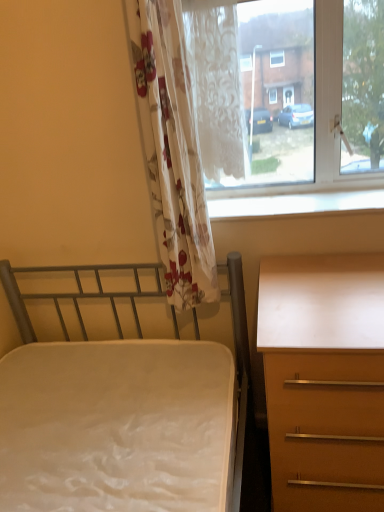
Measure the distance between floral fabric curtain at left, marked as the second curtain in a right-to-left arrangement, and camera.

A distance of 3.49 feet exists between floral fabric curtain at left, marked as the second curtain in a right-to-left arrangement, and camera.

Locate an element on the screen. Image resolution: width=384 pixels, height=512 pixels. white glossy window sill at upper center is located at coordinates (295, 204).

The width and height of the screenshot is (384, 512). In order to click on transparent glass window at upper right in this screenshot , I will do `click(330, 103)`.

In the scene shown: Does matte brown desk at right appear on the left side of transparent glass window at upper right?

Incorrect, matte brown desk at right is not on the left side of transparent glass window at upper right.

Considering the sizes of matte brown desk at right and transparent glass window at upper right in the image, is matte brown desk at right wider or thinner than transparent glass window at upper right?

Clearly, matte brown desk at right has more width compared to transparent glass window at upper right.

From the picture: Which of these two, matte brown desk at right or transparent glass window at upper right, stands shorter?

With less height is transparent glass window at upper right.

Based on the photo, is transparent glass window at upper right completely or partially inside matte brown desk at right?

No, transparent glass window at upper right is not surrounded by matte brown desk at right.

Considering the relative sizes of white lace curtain at upper center, placed as the second curtain when sorted from left to right, and matte brown desk at right in the image provided, is white lace curtain at upper center, placed as the second curtain when sorted from left to right, wider than matte brown desk at right?

No.

Looking at this image, which point is more forward, (247,159) or (339,283)?

The point (339,283) is closer.

Is white lace curtain at upper center, placed as the second curtain when sorted from left to right, taller than matte brown desk at right?

Incorrect, the height of white lace curtain at upper center, placed as the second curtain when sorted from left to right, is not larger of that of matte brown desk at right.

From a real-world perspective, which is physically below, white lace curtain at upper center, placed as the second curtain when sorted from left to right, or matte brown desk at right?

matte brown desk at right, from a real-world perspective.

Which is more to the right, floral fabric curtain at left, marked as the second curtain in a right-to-left arrangement, or metallic gray bed at left?

floral fabric curtain at left, marked as the second curtain in a right-to-left arrangement.

From the image's perspective, would you say floral fabric curtain at left, marked as the first curtain in a left-to-right arrangement, is positioned over metallic gray bed at left?

Yes.

Locate an element on the screen. Image resolution: width=384 pixels, height=512 pixels. the 1st curtain above the metallic gray bed at left (from the image's perspective) is located at coordinates (172, 151).

Does point (233, 160) come closer to viewer compared to point (196, 195)?

No, it is not.

Does white lace curtain at upper center, positioned as the 1th curtain in right-to-left order, turn towards floral fabric curtain at left, marked as the second curtain in a right-to-left arrangement?

Yes, white lace curtain at upper center, positioned as the 1th curtain in right-to-left order, is turned towards floral fabric curtain at left, marked as the second curtain in a right-to-left arrangement.

In the scene shown: Is white lace curtain at upper center, positioned as the 1th curtain in right-to-left order, not close to floral fabric curtain at left, marked as the first curtain in a left-to-right arrangement?

No, white lace curtain at upper center, positioned as the 1th curtain in right-to-left order, is in close proximity to floral fabric curtain at left, marked as the first curtain in a left-to-right arrangement.

From the image's perspective, between white lace curtain at upper center, placed as the second curtain when sorted from left to right, and floral fabric curtain at left, marked as the second curtain in a right-to-left arrangement, which one is located above?

white lace curtain at upper center, placed as the second curtain when sorted from left to right, from the image's perspective.

Can floral fabric curtain at left, marked as the second curtain in a right-to-left arrangement, be found inside matte brown desk at right?

Actually, floral fabric curtain at left, marked as the second curtain in a right-to-left arrangement, is outside matte brown desk at right.

Can you tell me how much matte brown desk at right and floral fabric curtain at left, marked as the second curtain in a right-to-left arrangement, differ in facing direction?

They differ by 1.59 degrees in their facing directions.

From a real-world perspective, between matte brown desk at right and floral fabric curtain at left, marked as the first curtain in a left-to-right arrangement, who is vertically lower?

matte brown desk at right.

Can you confirm if matte brown desk at right is bigger than floral fabric curtain at left, marked as the first curtain in a left-to-right arrangement?

Correct, matte brown desk at right is larger in size than floral fabric curtain at left, marked as the first curtain in a left-to-right arrangement.

Which curtain is the 2nd one when counting from the left side of the transparent glass window at upper right? Please provide its 2D coordinates.

[(172, 151)]

From a real-world perspective, is transparent glass window at upper right positioned above or below floral fabric curtain at left, marked as the first curtain in a left-to-right arrangement?

In terms of real-world spatial position, transparent glass window at upper right is above floral fabric curtain at left, marked as the first curtain in a left-to-right arrangement.

Is transparent glass window at upper right next to floral fabric curtain at left, marked as the second curtain in a right-to-left arrangement, and touching it?

No, transparent glass window at upper right is not making contact with floral fabric curtain at left, marked as the second curtain in a right-to-left arrangement.

Is transparent glass window at upper right at the left side of floral fabric curtain at left, marked as the first curtain in a left-to-right arrangement?

In fact, transparent glass window at upper right is to the right of floral fabric curtain at left, marked as the first curtain in a left-to-right arrangement.

Which point is more forward, (371, 359) or (23, 331)?

The point (371, 359) is in front.

The height and width of the screenshot is (512, 384). Find the location of `bed located above the matte brown desk at right (from a real-world perspective)`. bed located above the matte brown desk at right (from a real-world perspective) is located at coordinates (109, 379).

Between matte brown desk at right and metallic gray bed at left, which one has smaller width?

matte brown desk at right is thinner.

Is matte brown desk at right taller or shorter than metallic gray bed at left?

Clearly, matte brown desk at right is shorter compared to metallic gray bed at left.

At what (x,y) coordinates should I click in order to perform the action: click on window above the matte brown desk at right (from a real-world perspective). Please return your answer as a coordinate pair (x, y). Looking at the image, I should click on (330, 103).

Identify the location of desk that is in front of the white lace curtain at upper center, placed as the second curtain when sorted from left to right. The image size is (384, 512). (324, 380).

Considering their positions, is white lace curtain at upper center, positioned as the 1th curtain in right-to-left order, positioned closer to transparent glass window at upper right than matte brown desk at right?

The object closer to transparent glass window at upper right is white lace curtain at upper center, positioned as the 1th curtain in right-to-left order.

Looking at the image, which one is located further to transparent glass window at upper right, floral fabric curtain at left, marked as the second curtain in a right-to-left arrangement, or metallic gray bed at left?

metallic gray bed at left lies further to transparent glass window at upper right than the other object.

Estimate the real-world distances between objects in this image. Which object is further from matte brown desk at right, white glossy window sill at upper center or metallic gray bed at left?

white glossy window sill at upper center is positioned further to the anchor matte brown desk at right.

Based on their spatial positions, is matte brown desk at right or transparent glass window at upper right closer to white glossy window sill at upper center?

The object closer to white glossy window sill at upper center is transparent glass window at upper right.

Estimate the real-world distances between objects in this image. Which object is closer to white glossy window sill at upper center, metallic gray bed at left or white lace curtain at upper center, placed as the second curtain when sorted from left to right?

The object closer to white glossy window sill at upper center is white lace curtain at upper center, placed as the second curtain when sorted from left to right.

Which object lies nearer to the anchor point white glossy window sill at upper center, metallic gray bed at left or transparent glass window at upper right?

transparent glass window at upper right lies closer to white glossy window sill at upper center than the other object.

When comparing their distances from floral fabric curtain at left, marked as the first curtain in a left-to-right arrangement, does matte brown desk at right or transparent glass window at upper right seem further?

Based on the image, matte brown desk at right appears to be further to floral fabric curtain at left, marked as the first curtain in a left-to-right arrangement.

Based on their spatial positions, is white glossy window sill at upper center or metallic gray bed at left further from floral fabric curtain at left, marked as the first curtain in a left-to-right arrangement?

metallic gray bed at left lies further to floral fabric curtain at left, marked as the first curtain in a left-to-right arrangement, than the other object.

The width and height of the screenshot is (384, 512). Find the location of `desk between transparent glass window at upper right and metallic gray bed at left in the vertical direction`. desk between transparent glass window at upper right and metallic gray bed at left in the vertical direction is located at coordinates (324, 380).

The image size is (384, 512). In order to click on window sill between floral fabric curtain at left, marked as the second curtain in a right-to-left arrangement, and metallic gray bed at left vertically in this screenshot , I will do `click(295, 204)`.

Locate an element on the screen. The image size is (384, 512). window sill between transparent glass window at upper right and matte brown desk at right in the up-down direction is located at coordinates (295, 204).

Identify the location of window sill between floral fabric curtain at left, marked as the first curtain in a left-to-right arrangement, and matte brown desk at right in the up-down direction. (295, 204).